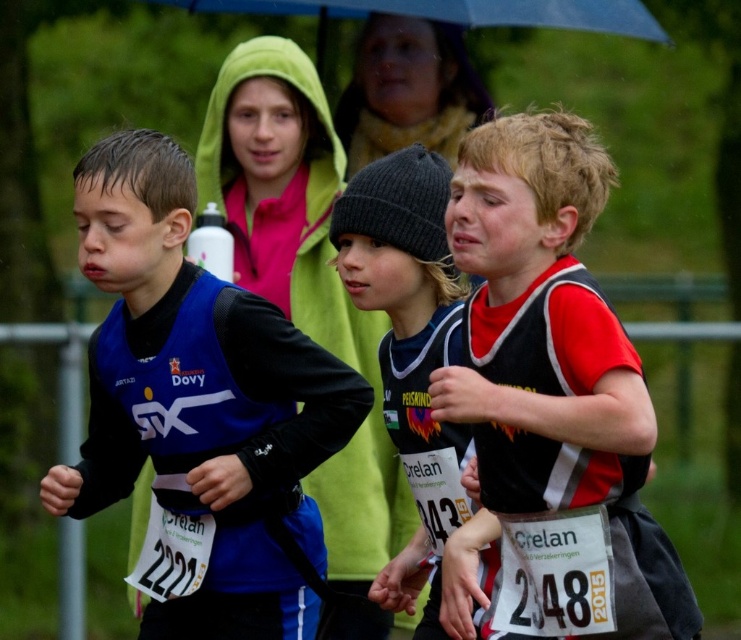
Question: Estimate the real-world distances between objects in this image. Which object is closer to the red and black jersey at center?

Choices:
 (A) blue matte vest at center
 (B) blue fabric jacket at center

Answer: (A)

Question: Which is farther from the blue matte vest at center?

Choices:
 (A) blue fabric jacket at center
 (B) red and black jersey at center
 (C) knit black beanie at center

Answer: (A)

Question: In this image, where is knit black beanie at center located relative to blue fabric jacket at center?

Choices:
 (A) below
 (B) above

Answer: (A)

Question: Is red and black jersey at center bigger than blue fabric jacket at center?

Choices:
 (A) yes
 (B) no

Answer: (B)

Question: Considering the relative positions of red and black jersey at center and blue fabric jacket at center in the image provided, where is red and black jersey at center located with respect to blue fabric jacket at center?

Choices:
 (A) below
 (B) above

Answer: (A)

Question: Among these points, which one is nearest to the camera?

Choices:
 (A) (536, 378)
 (B) (336, 248)
 (C) (336, 337)
 (D) (132, 305)

Answer: (A)